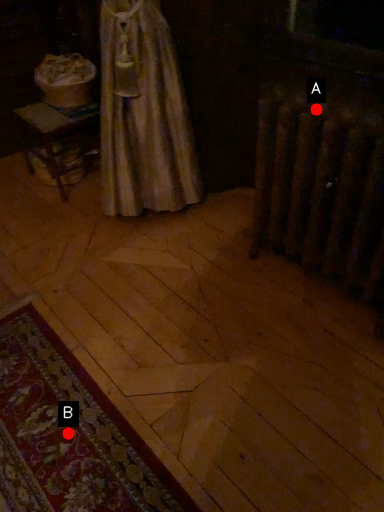
Question: Two points are circled on the image, labeled by A and B beside each circle. Which point is closer to the camera?

Choices:
 (A) A is closer
 (B) B is closer

Answer: (B)